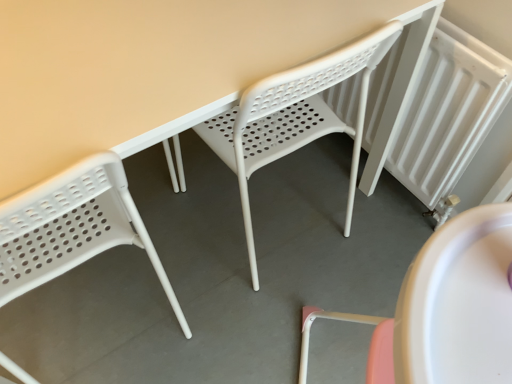
Locate an element on the screen. The height and width of the screenshot is (384, 512). free point below white textured radiator at right (from a real-world perspective) is located at coordinates (399, 195).